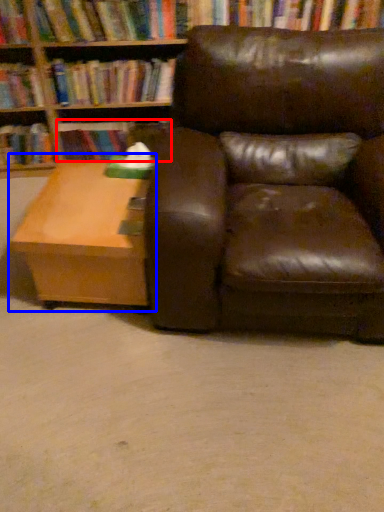
Question: Which of the following is the closest to the observer, book (highlighted by a red box) or table (highlighted by a blue box)?

Choices:
 (A) book
 (B) table

Answer: (B)